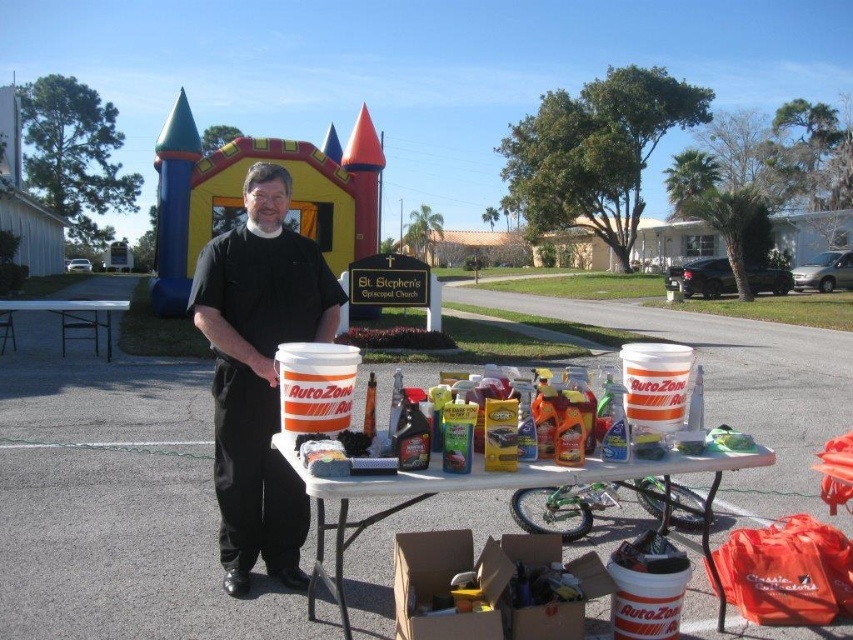
Question: Where is black matte shirt at center located in relation to white plastic table at center in the image?

Choices:
 (A) left
 (B) right

Answer: (A)

Question: Considering the real-world distances, which object is closest to the white plastic table at center?

Choices:
 (A) black matte shirt at center
 (B) white plastic table at left

Answer: (A)

Question: Is black matte shirt at center smaller than white plastic table at left?

Choices:
 (A) yes
 (B) no

Answer: (A)

Question: Which of these objects is positioned closest to the white plastic table at left?

Choices:
 (A) white plastic table at center
 (B) black matte shirt at center

Answer: (A)

Question: Does white plastic table at center come behind white plastic table at left?

Choices:
 (A) yes
 (B) no

Answer: (B)

Question: Which object is farther from the camera taking this photo?

Choices:
 (A) black matte shirt at center
 (B) white plastic table at left
 (C) white plastic table at center

Answer: (B)